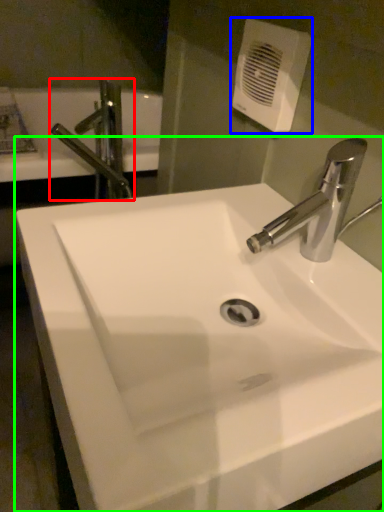
Question: Which object is the farthest from tap (highlighted by a red box)? Choose among these: hand dryer (highlighted by a blue box) or sink (highlighted by a green box).

Choices:
 (A) hand dryer
 (B) sink

Answer: (B)